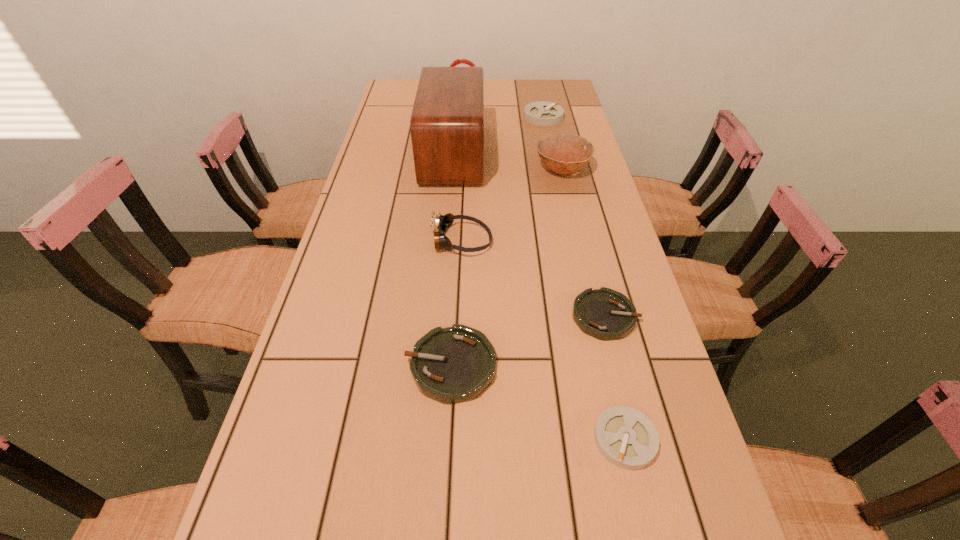
Identify the location of free space that satisfies the following two spatial constraints: 1. on the face of the left green ashtray; 2. on the left side of the red watch. This screenshot has height=540, width=960. (444, 366).

Where is `free spot that satisfies the following two spatial constraints: 1. on the back side of the bowl; 2. on the face of the watch`? This screenshot has height=540, width=960. free spot that satisfies the following two spatial constraints: 1. on the back side of the bowl; 2. on the face of the watch is located at coordinates (543, 89).

The width and height of the screenshot is (960, 540). Identify the location of vacant space that satisfies the following two spatial constraints: 1. on the face of the red watch; 2. on the back side of the brown bowl. (458, 169).

Locate an element on the screen. This screenshot has height=540, width=960. vacant region that satisfies the following two spatial constraints: 1. on the face of the red watch; 2. on the back side of the right green ashtray is located at coordinates (448, 316).